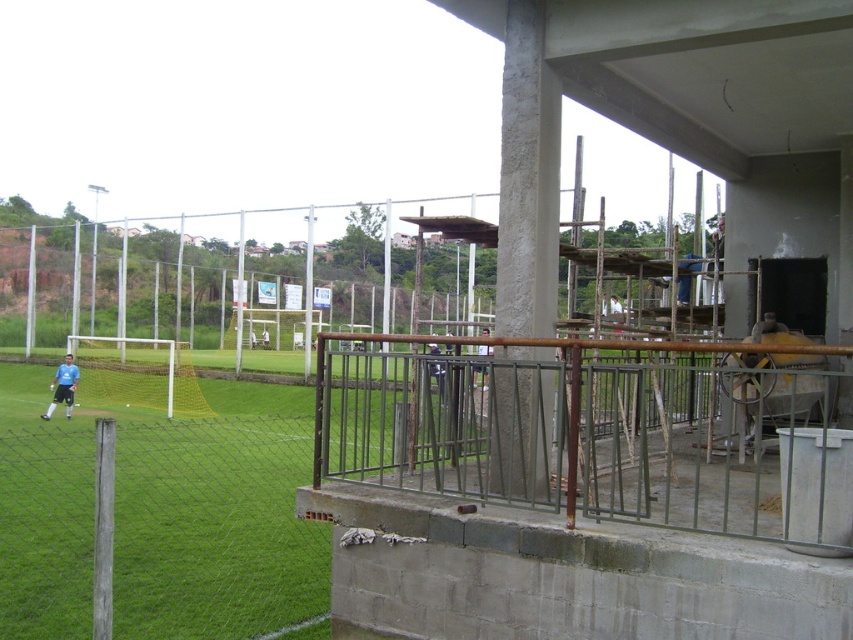
How distant is blue fabric shirt at upper right from blue matte shirt at lower left?

blue fabric shirt at upper right and blue matte shirt at lower left are 15.23 meters apart from each other.

Between blue fabric shirt at upper right and blue matte shirt at lower left, which one appears on the left side from the viewer's perspective?

From the viewer's perspective, blue matte shirt at lower left appears more on the left side.

You are a GUI agent. You are given a task and a screenshot of the screen. Output one action in this format:
    pyautogui.click(x=<x>, y=<y>)
    Task: Click on the blue fabric shirt at upper right
    The width and height of the screenshot is (853, 640).
    Given the screenshot: What is the action you would take?
    pyautogui.click(x=718, y=241)

Does point (776, 417) lie in front of point (682, 266)?

Yes.

Is the position of rusty metal railing at center less distant than that of blue fabric shirt at upper right?

That is True.

This screenshot has height=640, width=853. What do you see at coordinates (601, 429) in the screenshot? I see `rusty metal railing at center` at bounding box center [601, 429].

Locate an element on the screen. This screenshot has width=853, height=640. rusty metal railing at center is located at coordinates (601, 429).

Between rusty metal railing at center and blue matte shirt at lower left, which one is positioned lower?

blue matte shirt at lower left is below.

Is point (672, 493) in front of point (68, 417)?

That is True.

Identify the location of rusty metal railing at center. The width and height of the screenshot is (853, 640). (601, 429).